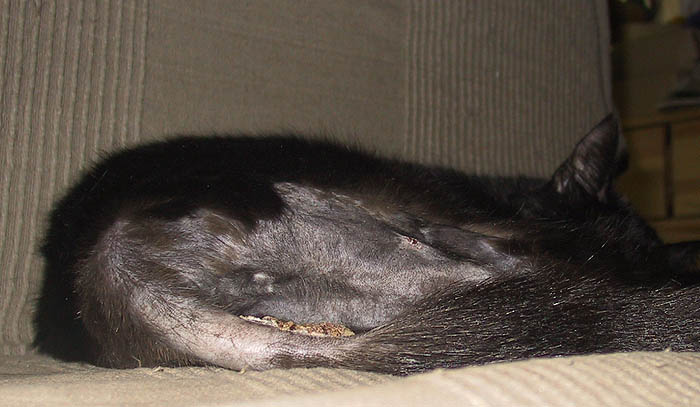
Identify the location of tan nonribbed portion of blanket. This screenshot has width=700, height=407. (262, 37).